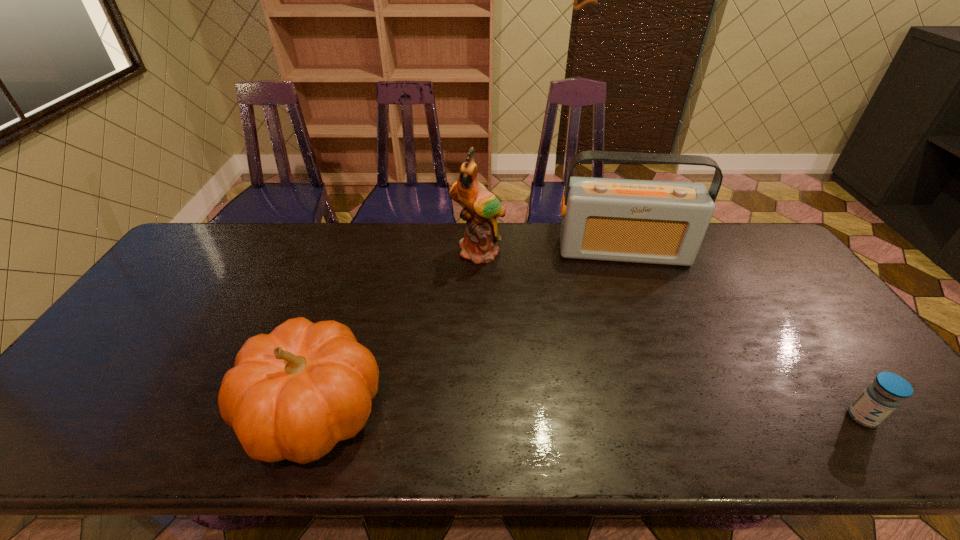
Identify the location of free area in between the medicine and the radio receiver. (743, 334).

Where is `empty space that is in between the rightmost object and the parrot`? This screenshot has height=540, width=960. empty space that is in between the rightmost object and the parrot is located at coordinates (670, 335).

Locate an element on the screen. The width and height of the screenshot is (960, 540). free space between the radio receiver and the medicine is located at coordinates (743, 334).

Identify the location of vacant space that's between the third object from left to right and the medicine. (743, 334).

Where is `vacant area that lies between the medicine and the radio receiver`? The width and height of the screenshot is (960, 540). vacant area that lies between the medicine and the radio receiver is located at coordinates (743, 334).

Identify the location of free space between the medicine and the parrot. Image resolution: width=960 pixels, height=540 pixels. (670, 335).

Locate an element on the screen. The height and width of the screenshot is (540, 960). the second closest object to the parrot is located at coordinates (293, 394).

Identify the location of object that can be found as the second closest to the second object from left to right. The height and width of the screenshot is (540, 960). (293, 394).

Locate an element on the screen. The image size is (960, 540). vacant point that satisfies the following two spatial constraints: 1. on the back side of the parrot; 2. on the left side of the leftmost object is located at coordinates (364, 253).